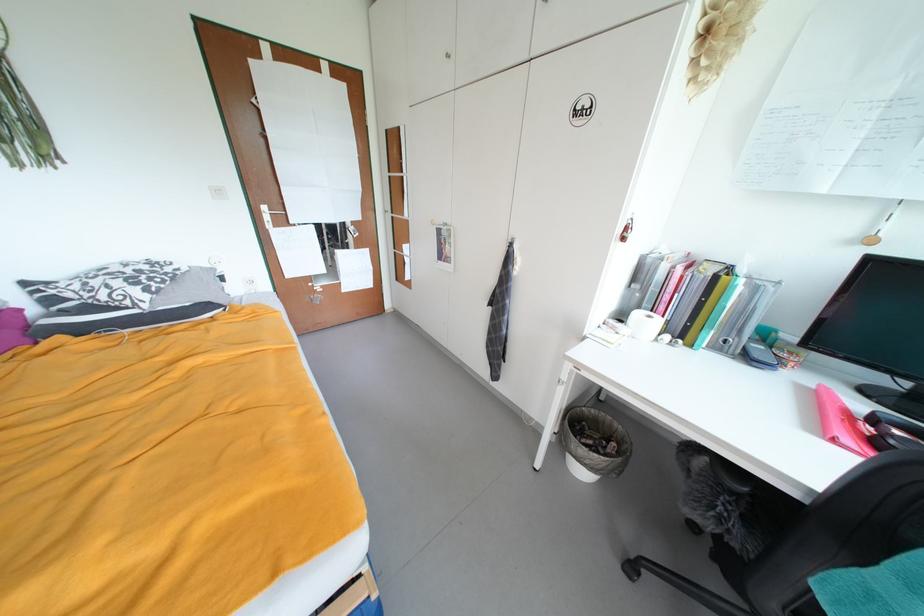
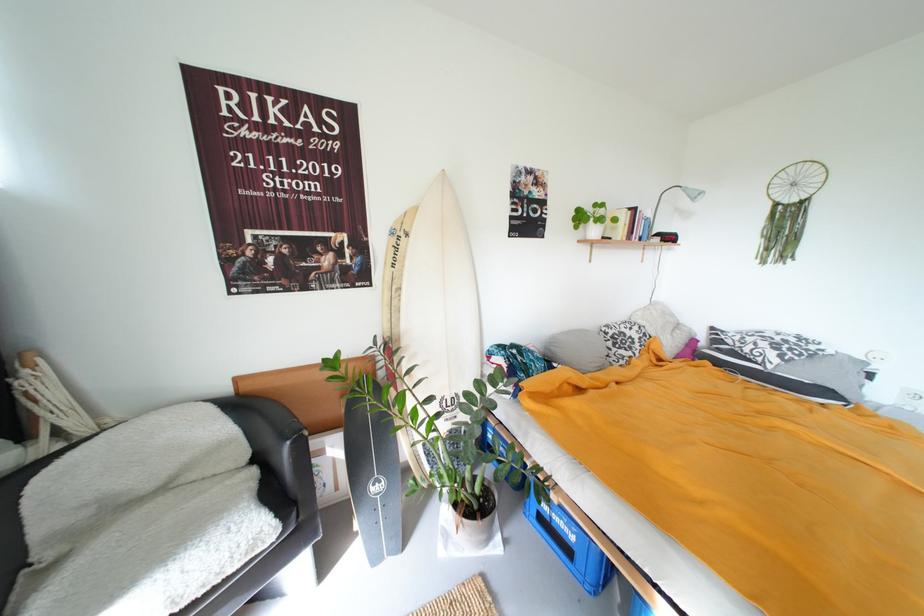
Question: Based on the continuous images, in which direction is the camera rotating? Reply with the corresponding letter.

Choices:
 (A) Left
 (B) Right
 (C) Up
 (D) Down

Answer: (A)